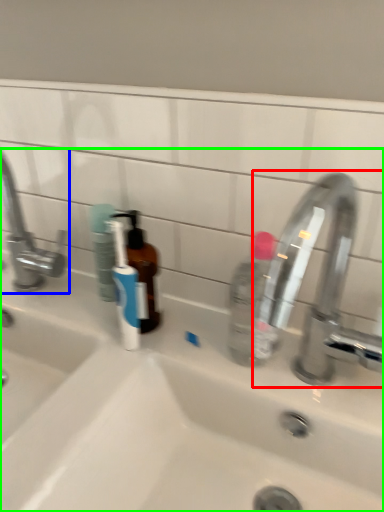
Question: Considering the real-world distances, which object is closest to tap (highlighted by a red box)? tap (highlighted by a blue box) or sink (highlighted by a green box).

Choices:
 (A) tap
 (B) sink

Answer: (B)